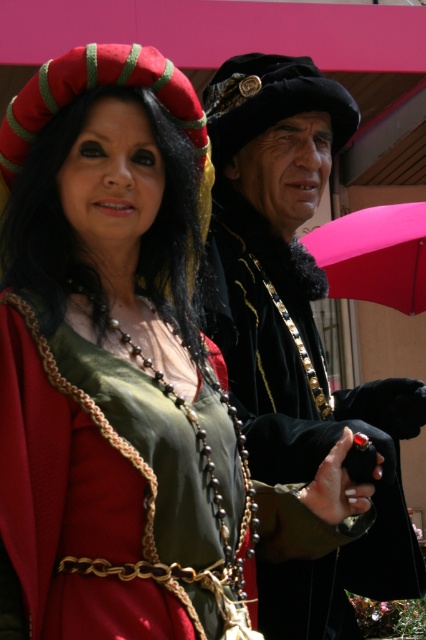
Question: Which point appears farthest from the camera in this image?

Choices:
 (A) (365, 232)
 (B) (65, 416)

Answer: (A)

Question: Can you confirm if velvet black coat at center is smaller than green satin dress at center?

Choices:
 (A) no
 (B) yes

Answer: (A)

Question: Is velvet black coat at center to the right of green satin dress at center from the viewer's perspective?

Choices:
 (A) no
 (B) yes

Answer: (B)

Question: Which of the following is the closest to the observer?

Choices:
 (A) (417, 292)
 (B) (322, 109)
 (C) (172, 540)

Answer: (C)

Question: Which point is closer to the camera?

Choices:
 (A) (296, 273)
 (B) (394, 204)

Answer: (A)

Question: Is velvet black coat at center wider than green satin dress at center?

Choices:
 (A) yes
 (B) no

Answer: (A)